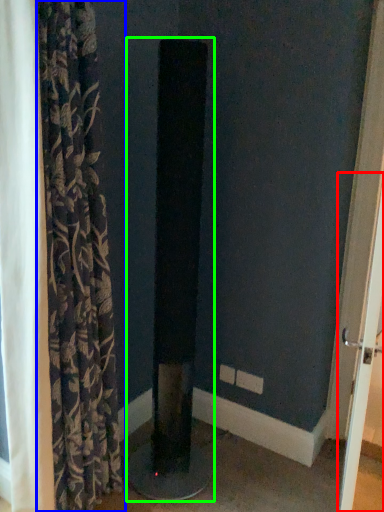
Question: Which object is positioned closest to screen door (highlighted by a red box)? Select from curtain (highlighted by a blue box) and pillar (highlighted by a green box).

Choices:
 (A) curtain
 (B) pillar

Answer: (B)